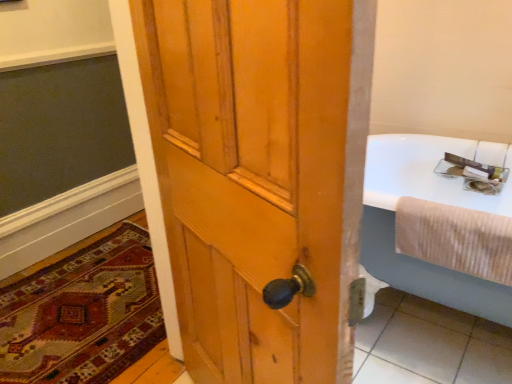
What do you see at coordinates (82, 313) in the screenshot?
I see `carpeted rug at lower left` at bounding box center [82, 313].

Find the location of a particular element. The image size is (512, 384). carpeted rug at lower left is located at coordinates (82, 313).

The width and height of the screenshot is (512, 384). Describe the element at coordinates (455, 238) in the screenshot. I see `beige ribbed towel at right` at that location.

Identify the location of beige ribbed towel at right. This screenshot has width=512, height=384. (455, 238).

You are a GUI agent. You are given a task and a screenshot of the screen. Output one action in this format:
    pyautogui.click(x=<x>, y=<y>)
    Task: Click on the carpeted rug at lower left
    
    Given the screenshot: What is the action you would take?
    pyautogui.click(x=82, y=313)

Considering the positions of objects beige ribbed towel at right and carpeted rug at lower left in the image provided, who is more to the left, beige ribbed towel at right or carpeted rug at lower left?

carpeted rug at lower left is more to the left.

Which is in front, beige ribbed towel at right or carpeted rug at lower left?

beige ribbed towel at right.

Considering the positions of points (415, 240) and (67, 257), is point (415, 240) farther from camera compared to point (67, 257)?

No, (415, 240) is in front of (67, 257).

From the image's perspective, who appears lower, beige ribbed towel at right or carpeted rug at lower left?

carpeted rug at lower left appears lower in the image.

From a real-world perspective, which is physically above, beige ribbed towel at right or carpeted rug at lower left?

beige ribbed towel at right.

Which of these two, beige ribbed towel at right or carpeted rug at lower left, is wider?

With larger width is carpeted rug at lower left.

Who is taller, beige ribbed towel at right or carpeted rug at lower left?

With more height is beige ribbed towel at right.

Does beige ribbed towel at right have a larger size compared to carpeted rug at lower left?

No, beige ribbed towel at right is not bigger than carpeted rug at lower left.

Is beige ribbed towel at right positioned beyond the bounds of carpeted rug at lower left?

Yes, beige ribbed towel at right is not within carpeted rug at lower left.

Would you consider beige ribbed towel at right to be distant from carpeted rug at lower left?

beige ribbed towel at right is far away from carpeted rug at lower left.

Is beige ribbed towel at right oriented towards carpeted rug at lower left?

No, beige ribbed towel at right is not aimed at carpeted rug at lower left.

Locate an element on the screen. The height and width of the screenshot is (384, 512). bath towel above the carpeted rug at lower left (from the image's perspective) is located at coordinates (455, 238).

Considering the relative positions of carpeted rug at lower left and beige ribbed towel at right in the image provided, is carpeted rug at lower left to the right of beige ribbed towel at right from the viewer's perspective?

No.

Looking at this image, between carpeted rug at lower left and beige ribbed towel at right, which one is positioned behind?

carpeted rug at lower left is more distant.

Considering the positions of point (51, 379) and point (471, 249), is point (51, 379) closer or farther from the camera than point (471, 249)?

Clearly, point (51, 379) is more distant from the camera than point (471, 249).

From the image's perspective, which is below, carpeted rug at lower left or beige ribbed towel at right?

carpeted rug at lower left appears lower in the image.

From a real-world perspective, is carpeted rug at lower left over beige ribbed towel at right?

No, from a real-world perspective, carpeted rug at lower left is not over beige ribbed towel at right

From the picture: Which object is thinner, carpeted rug at lower left or beige ribbed towel at right?

beige ribbed towel at right.

Considering the relative sizes of carpeted rug at lower left and beige ribbed towel at right in the image provided, is carpeted rug at lower left shorter than beige ribbed towel at right?

Correct, carpeted rug at lower left is not as tall as beige ribbed towel at right.

Looking at this image, which of these two, carpeted rug at lower left or beige ribbed towel at right, is smaller?

With smaller size is beige ribbed towel at right.

Would you say beige ribbed towel at right is part of carpeted rug at lower left's contents?

No, beige ribbed towel at right is not surrounded by carpeted rug at lower left.

Would you say carpeted rug at lower left is a long distance from beige ribbed towel at right?

Yes, carpeted rug at lower left and beige ribbed towel at right are located far from each other.

Looking at this image, could you tell me if carpeted rug at lower left is facing beige ribbed towel at right?

No, carpeted rug at lower left is not facing towards beige ribbed towel at right.

Measure the distance between carpeted rug at lower left and beige ribbed towel at right.

carpeted rug at lower left and beige ribbed towel at right are 1.36 meters apart.

This screenshot has height=384, width=512. Find the location of `bath towel positioned vertically above the carpeted rug at lower left (from a real-world perspective)`. bath towel positioned vertically above the carpeted rug at lower left (from a real-world perspective) is located at coordinates (455, 238).

Where is `mat that appears behind the beige ribbed towel at right`? mat that appears behind the beige ribbed towel at right is located at coordinates (82, 313).

In the image, there is a beige ribbed towel at right. In order to click on mat below it (from a real-world perspective) in this screenshot , I will do `click(82, 313)`.